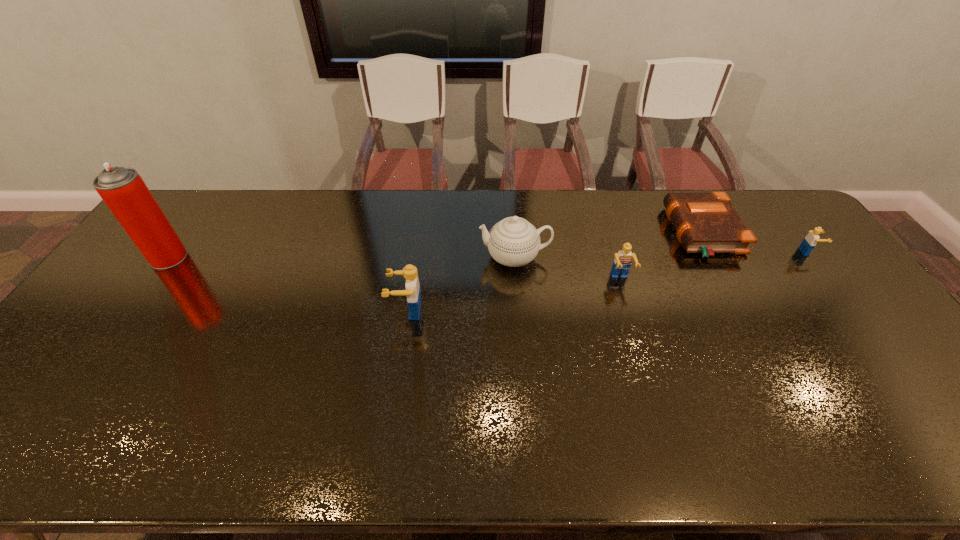
Select which object is the second closest to the tallest object. Please provide its 2D coordinates. Your answer should be formatted as a tuple, i.e. [(x, y)], where the tuple contains the x and y coordinates of a point satisfying the conditions above.

[(513, 241)]

Select which object appears as the third closest to the second nearest Lego. Please provide its 2D coordinates. Your answer should be formatted as a tuple, i.e. [(x, y)], where the tuple contains the x and y coordinates of a point satisfying the conditions above.

[(413, 291)]

Image resolution: width=960 pixels, height=540 pixels. What are the coordinates of `Lego that is the third closest to the shortest object` in the screenshot? It's located at (413, 291).

Locate an element on the screen. The image size is (960, 540). Lego that can be found as the third closest to the leftmost object is located at coordinates (809, 242).

This screenshot has height=540, width=960. I want to click on vacant region that satisfies the following two spatial constraints: 1. on the spine side of the shortest object; 2. on the face of the fourth tallest object, so click(728, 280).

Locate an element on the screen. Image resolution: width=960 pixels, height=540 pixels. free location that satisfies the following two spatial constraints: 1. on the face of the fourth object from left to right; 2. on the face of the nearest Lego is located at coordinates tap(630, 311).